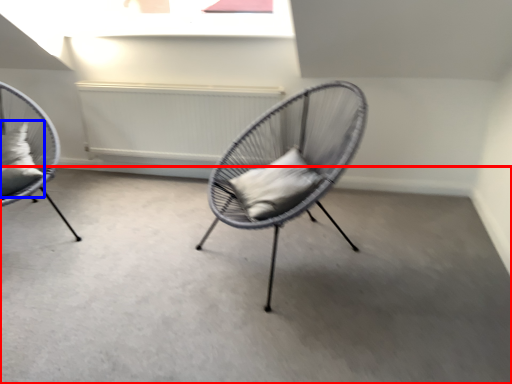
Question: Which object is further to the camera taking this photo, concrete (highlighted by a red box) or pillow (highlighted by a blue box)?

Choices:
 (A) concrete
 (B) pillow

Answer: (B)